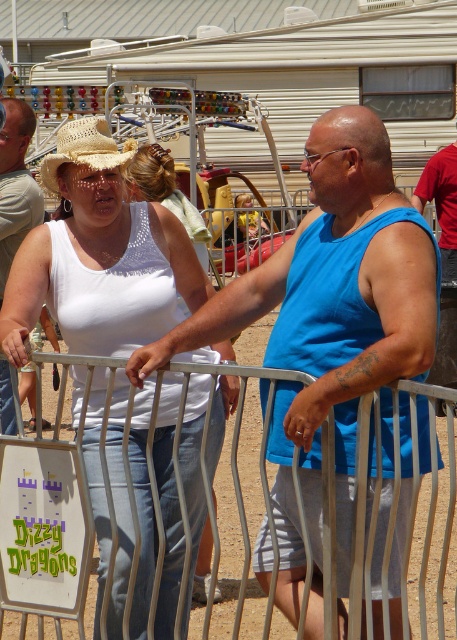
Question: Does white crochet tank top at center have a smaller size compared to blue fabric tank top at center?

Choices:
 (A) no
 (B) yes

Answer: (A)

Question: Observing the image, what is the correct spatial positioning of white crochet tank top at center in reference to metallic silver gate at center?

Choices:
 (A) left
 (B) right

Answer: (A)

Question: Which point is farther to the camera?

Choices:
 (A) white crochet tank top at center
 (B) metallic silver gate at center
 (C) blue fabric tank top at center

Answer: (C)

Question: Is metallic silver gate at center above blue fabric tank top at center?

Choices:
 (A) yes
 (B) no

Answer: (B)

Question: Considering the real-world distances, which object is closest to the white crochet tank top at center?

Choices:
 (A) metallic silver gate at center
 (B) blue fabric tank top at center
 (C) red cotton shirt at upper right

Answer: (B)

Question: Which point appears farthest from the camera in this image?

Choices:
 (A) (430, 184)
 (B) (31, 193)
 (C) (277, 396)

Answer: (A)